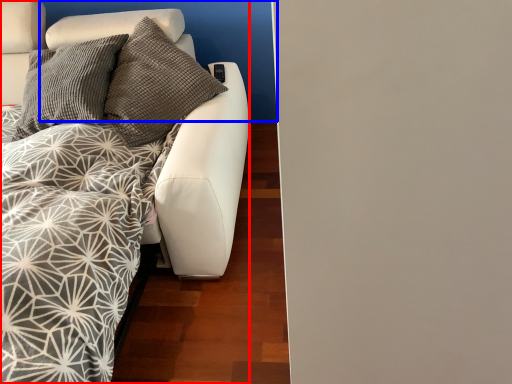
Question: Which of the following is the farthest to the observer, furniture (highlighted by a red box) or backdrop (highlighted by a blue box)?

Choices:
 (A) furniture
 (B) backdrop

Answer: (B)